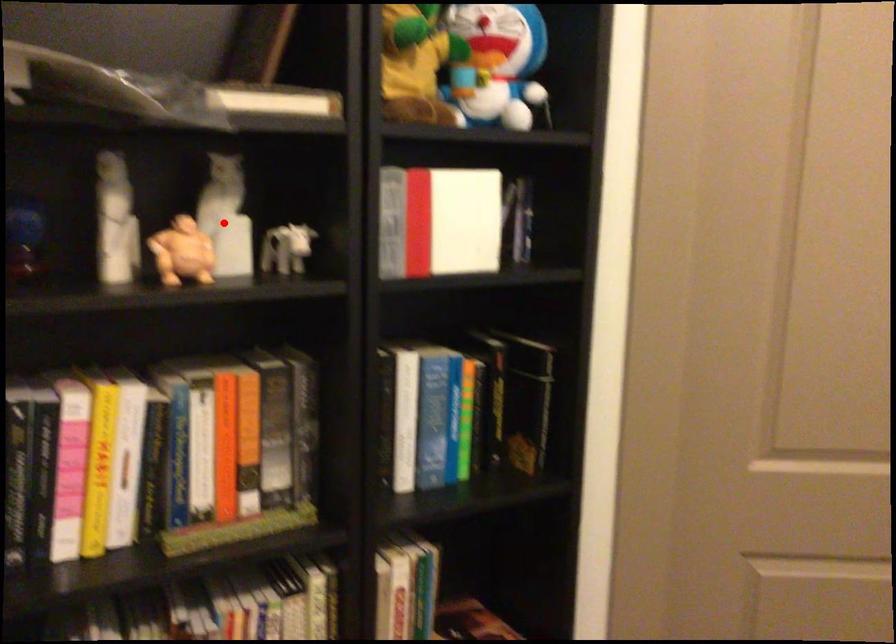
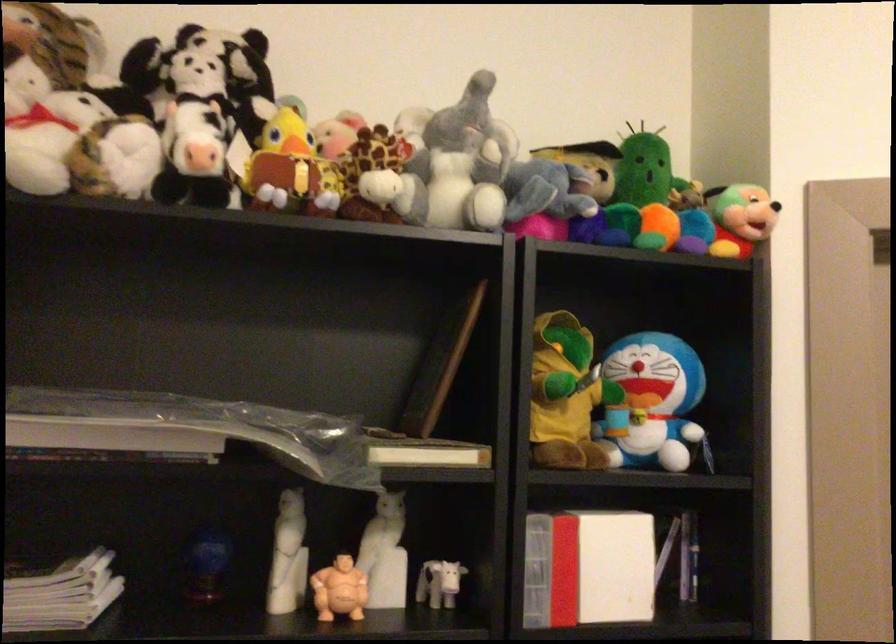
Find the pixel in the second image that matches the highlighted location in the first image.

(384, 554)